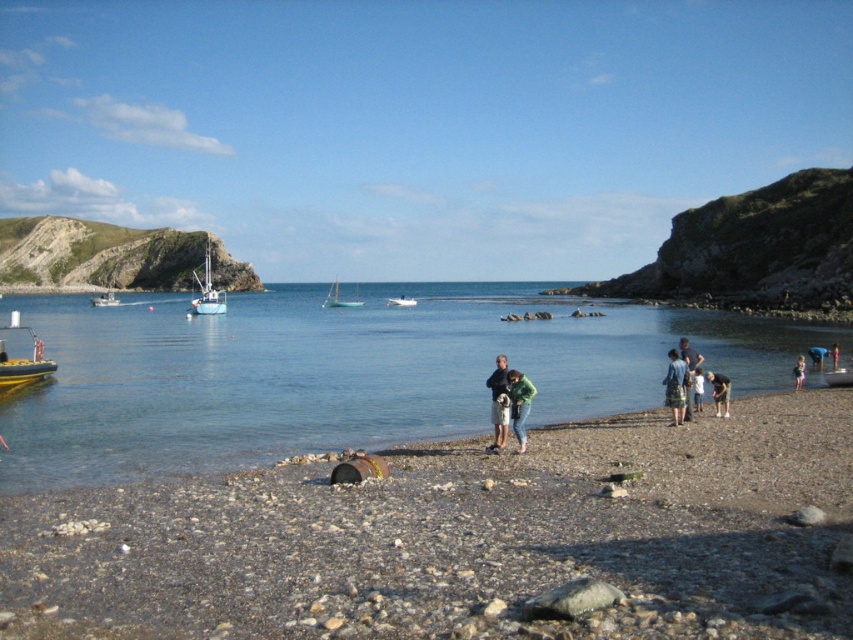
Question: Can you confirm if white glossy boat at center-left is positioned below white plastic boat at center?

Choices:
 (A) yes
 (B) no

Answer: (B)

Question: Can you confirm if white glossy boat at center-left is bigger than white plastic boat at left?

Choices:
 (A) yes
 (B) no

Answer: (A)

Question: Does clear blue water at center have a larger size compared to light brown fabric pants at lower right?

Choices:
 (A) no
 (B) yes

Answer: (B)

Question: Which of these objects is positioned farthest from the teal glossy sailboat at center?

Choices:
 (A) white plastic boat at left
 (B) clear blue water at center
 (C) green fabric shirt at lower right
 (D) yellow rubber boat at lower left

Answer: (C)

Question: Which point is closer to the camera?

Choices:
 (A) (42, 440)
 (B) (798, 380)

Answer: (A)

Question: Which point is farther to the camera?

Choices:
 (A) green fabric shirt at center
 (B) rusty metal barrel at center
 (C) green fabric shirt at lower right

Answer: (C)